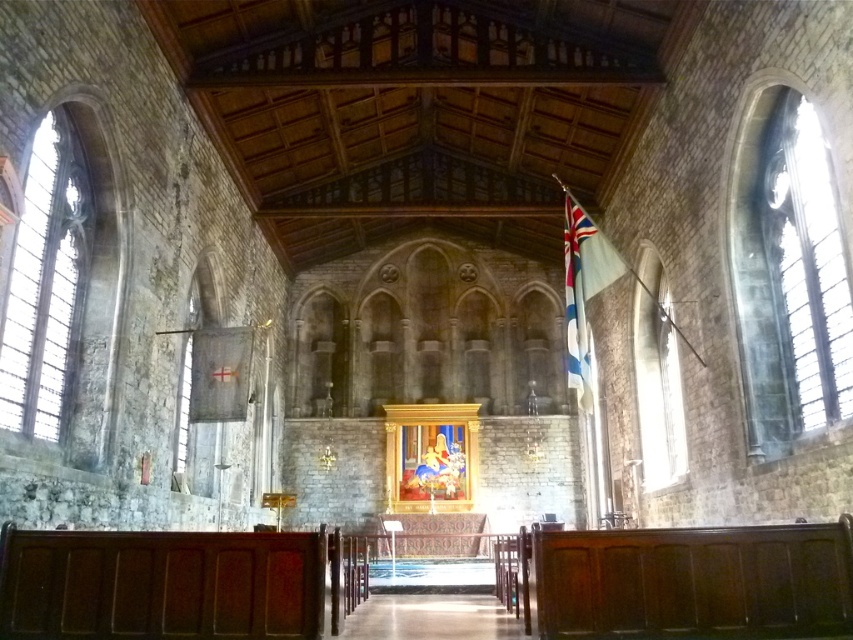
You are standing inside the historic stone church and want to determine which of the two points, point (x=819, y=397) or point (x=606, y=240), is nearer to you. Based on the scene, which point is closer?

Point (x=819, y=397) is closer to the viewer than point (x=606, y=240).

You are standing inside the historic stone church and want to determine which object is taller between the clear glass window at left and the white fabric flag at upper right. Based on the scene, which one is taller?

The white fabric flag at upper right is taller than the clear glass window at left.